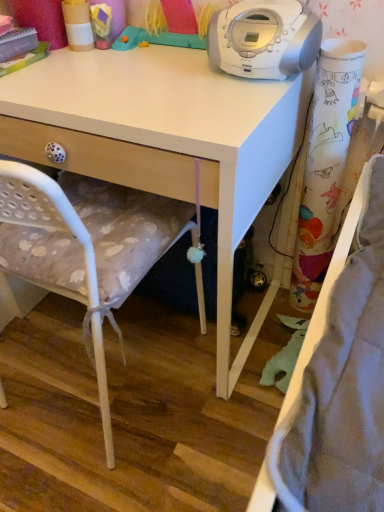
Describe the element at coordinates (164, 140) in the screenshot. The height and width of the screenshot is (512, 384). I see `white matte desk at upper center` at that location.

Where is `white matte desk at upper center`? The height and width of the screenshot is (512, 384). white matte desk at upper center is located at coordinates (164, 140).

What is the approximate height of white plastic stereo at upper center?

white plastic stereo at upper center is 6.20 inches in height.

Image resolution: width=384 pixels, height=512 pixels. Identify the location of colorful paper curtain at right. (325, 165).

This screenshot has height=512, width=384. I want to click on white matte desk at upper center, so click(x=164, y=140).

Does white matte desk at upper center have a lesser width compared to colorful paper curtain at right?

No.

Is white matte desk at upper center facing away from colorful paper curtain at right?

No, white matte desk at upper center is not facing away from colorful paper curtain at right.

Is colorful paper curtain at right completely or partially inside white matte desk at upper center?

No, colorful paper curtain at right is not a part of white matte desk at upper center.

From the image's perspective, which is below, white matte desk at upper center or colorful paper curtain at right?

colorful paper curtain at right appears lower in the image.

What's the angular difference between white plastic stereo at upper center and white fabric chair at center's facing directions?

The facing directions of white plastic stereo at upper center and white fabric chair at center are 178 degrees apart.

Does white plastic stereo at upper center have a smaller size compared to white fabric chair at center?

Indeed, white plastic stereo at upper center has a smaller size compared to white fabric chair at center.

Is white plastic stereo at upper center not inside white fabric chair at center?

Yes, white plastic stereo at upper center is located beyond the bounds of white fabric chair at center.

From the image's perspective, does white plastic stereo at upper center appear higher than white fabric chair at center?

Yes, from the image's perspective, white plastic stereo at upper center is above white fabric chair at center.

From a real-world perspective, which is physically below, white fabric chair at center or colorful paper curtain at right?

In real-world perspective, white fabric chair at center is lower.

From the image's perspective, would you say white fabric chair at center is positioned over colorful paper curtain at right?

Actually, white fabric chair at center appears below colorful paper curtain at right in the image.

At what (x,y) coordinates should I click in order to perform the action: click on curtain above the white fabric chair at center (from a real-world perspective). Please return your answer as a coordinate pair (x, y). Looking at the image, I should click on (325, 165).

From the image's perspective, is colorful paper curtain at right positioned above or below white matte desk at upper center?

From the image's perspective, colorful paper curtain at right appears below white matte desk at upper center.

In the scene shown: From a real-world perspective, which object stands above the other?

colorful paper curtain at right is physically above.

What's the angular difference between colorful paper curtain at right and white matte desk at upper center's facing directions?

There is a 2.01-degree angle between the facing directions of colorful paper curtain at right and white matte desk at upper center.

Is colorful paper curtain at right further to the viewer compared to white plastic stereo at upper center?

That is True.

Considering the positions of point (314, 247) and point (263, 77), is point (314, 247) closer or farther from the camera than point (263, 77)?

Point (314, 247) appears to be farther away from the viewer than point (263, 77).

Between colorful paper curtain at right and white plastic stereo at upper center, which one has smaller width?

Thinner between the two is colorful paper curtain at right.

Is colorful paper curtain at right situated inside white plastic stereo at upper center or outside?

colorful paper curtain at right is not enclosed by white plastic stereo at upper center.

Which is behind, white fabric chair at center or white plastic stereo at upper center?

white plastic stereo at upper center is further from the camera.

Between point (201, 311) and point (294, 50), which one is positioned in front?

Point (294, 50)

Which of these two, white fabric chair at center or white plastic stereo at upper center, is smaller?

white plastic stereo at upper center.

Based on the photo, is white fabric chair at center placed right next to white plastic stereo at upper center?

No.

Can you confirm if white plastic stereo at upper center is smaller than white matte desk at upper center?

Yes, white plastic stereo at upper center is smaller than white matte desk at upper center.

Could you tell me if white plastic stereo at upper center is facing white matte desk at upper center?

No, white plastic stereo at upper center does not turn towards white matte desk at upper center.

What's the angular difference between white plastic stereo at upper center and white matte desk at upper center's facing directions?

2.01 degrees separate the facing orientations of white plastic stereo at upper center and white matte desk at upper center.

This screenshot has height=512, width=384. Identify the location of curtain lying on the right of white matte desk at upper center. (325, 165).

At what (x,y) coordinates should I click in order to perform the action: click on home appliance above the white fabric chair at center (from the image's perspective). Please return your answer as a coordinate pair (x, y). The image size is (384, 512). Looking at the image, I should click on (264, 39).

Based on their spatial positions, is white matte desk at upper center or colorful paper curtain at right further from white plastic stereo at upper center?

colorful paper curtain at right.

When comparing their distances from white matte desk at upper center, does white plastic stereo at upper center or white fabric chair at center seem closer?

white fabric chair at center is closer to white matte desk at upper center.

Considering their positions, is white matte desk at upper center positioned closer to white plastic stereo at upper center than white fabric chair at center?

The object closer to white plastic stereo at upper center is white matte desk at upper center.

Looking at the image, which one is located closer to white plastic stereo at upper center, colorful paper curtain at right or white fabric chair at center?

The object closer to white plastic stereo at upper center is colorful paper curtain at right.

From the image, which object appears to be farther from white fabric chair at center, white plastic stereo at upper center or colorful paper curtain at right?

colorful paper curtain at right is further to white fabric chair at center.

Estimate the real-world distances between objects in this image. Which object is further from white plastic stereo at upper center, white fabric chair at center or white matte desk at upper center?

white fabric chair at center.

Based on their spatial positions, is colorful paper curtain at right or white fabric chair at center closer to white matte desk at upper center?

white fabric chair at center lies closer to white matte desk at upper center than the other object.

Based on their spatial positions, is white matte desk at upper center or white plastic stereo at upper center further from white fabric chair at center?

white plastic stereo at upper center is further to white fabric chair at center.

The height and width of the screenshot is (512, 384). What are the coordinates of `desk between white fabric chair at center and colorful paper curtain at right in the horizontal direction` in the screenshot? It's located at (164, 140).

What are the coordinates of `home appliance between white matte desk at upper center and colorful paper curtain at right from left to right` in the screenshot? It's located at (264, 39).

You are a GUI agent. You are given a task and a screenshot of the screen. Output one action in this format:
    pyautogui.click(x=<x>, y=<y>)
    Task: Click on the desk between white plastic stereo at upper center and white fabric chair at center in the up-down direction
    
    Given the screenshot: What is the action you would take?
    pyautogui.click(x=164, y=140)

Find the location of a particular element. home appliance between white fabric chair at center and colorful paper curtain at right from left to right is located at coordinates (264, 39).